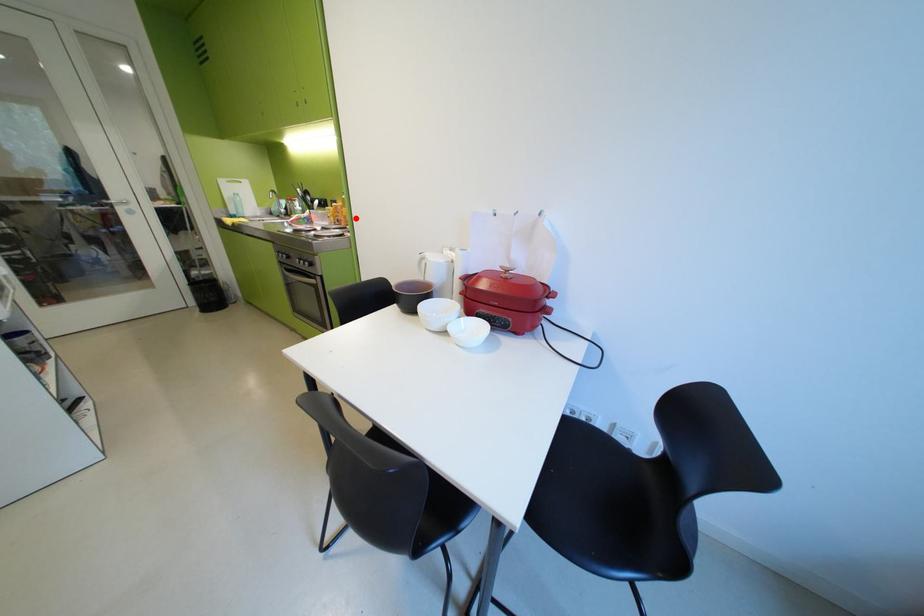
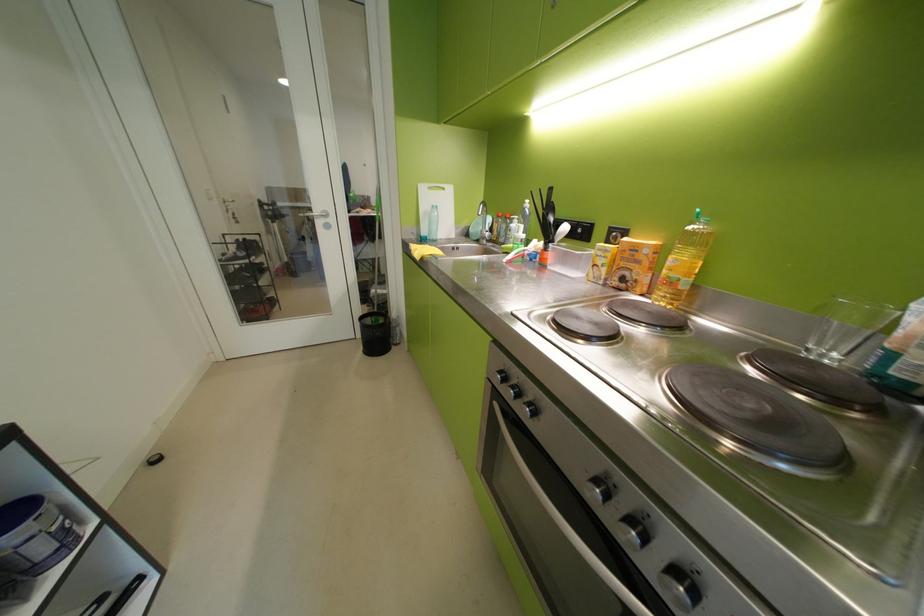
The point at the highlighted location is marked in the first image. Where is the corresponding point in the second image?

(681, 284)